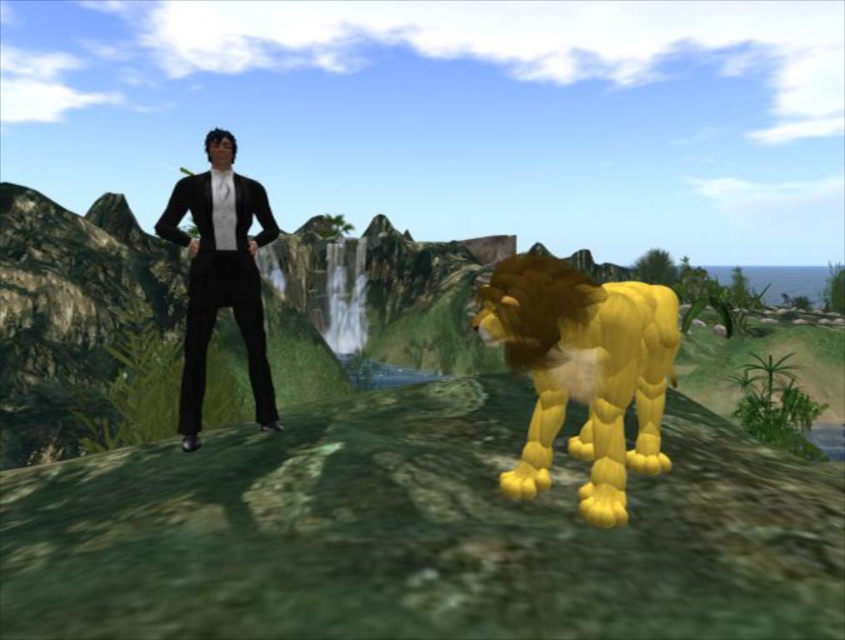
Question: Where is yellow matte lion at center located in relation to black glossy suit at center in the image?

Choices:
 (A) above
 (B) below

Answer: (B)

Question: Which object is closer to the camera taking this photo?

Choices:
 (A) yellow matte lion at center
 (B) black glossy suit at center

Answer: (A)

Question: Is yellow matte lion at center above black glossy suit at center?

Choices:
 (A) yes
 (B) no

Answer: (B)

Question: Which point is closer to the camera?

Choices:
 (A) black glossy suit at center
 (B) yellow matte lion at center

Answer: (B)

Question: Considering the relative positions of yellow matte lion at center and black glossy suit at center in the image provided, where is yellow matte lion at center located with respect to black glossy suit at center?

Choices:
 (A) left
 (B) right

Answer: (B)